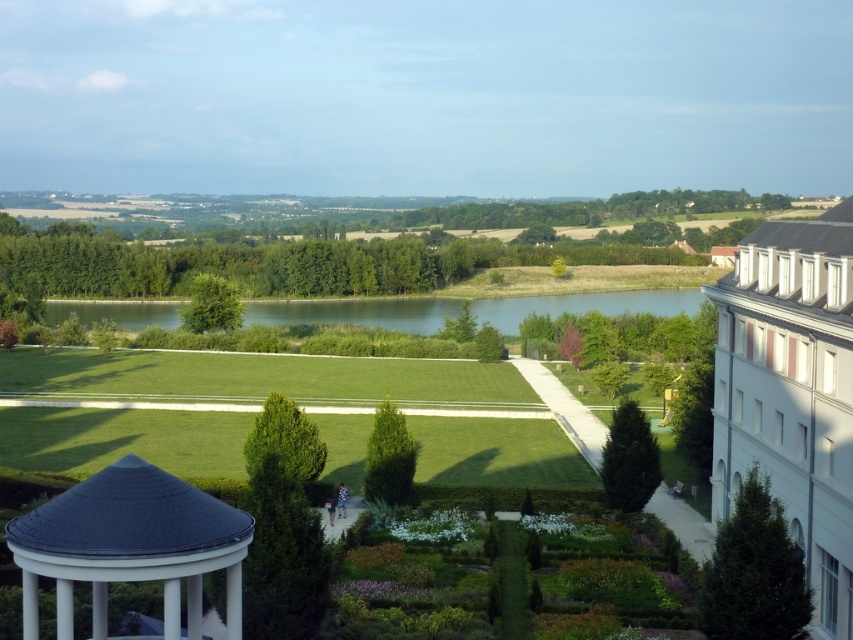
You are standing at the entrance of the garden and want to walk towards the modern building on the right. There are two points marked in the image, point A at coordinates point A is point (x=76, y=538) and point B at coordinates point B is point (x=137, y=323). Which point should you aim for to reach the modern building first?

You should aim for point A at coordinates point A is point (x=76, y=538) because it is in front of point B at coordinates point B is point (x=137, y=323), meaning it is closer to your current position at the garden entrance.

You are a visitor in the garden and want to reach the green smooth water at center. Which direction should you move relative to the white textured gazebo at lower left?

The white textured gazebo at lower left is positioned under the green smooth water at center, so you should move towards the center from the gazebo to reach the water.